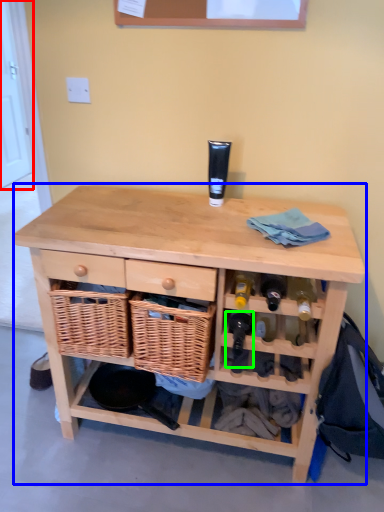
Question: Which is nearer to the door (highlighted by a red box)? table (highlighted by a blue box) or wine bottle (highlighted by a green box).

Choices:
 (A) table
 (B) wine bottle

Answer: (A)